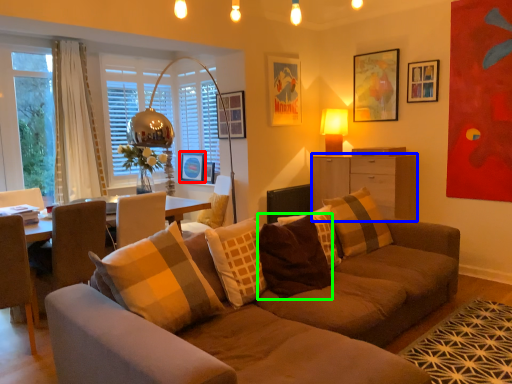
Question: Which is nearer to the picture frame (highlighted by a red box)? cabinetry (highlighted by a blue box) or pillow (highlighted by a green box).

Choices:
 (A) cabinetry
 (B) pillow

Answer: (A)